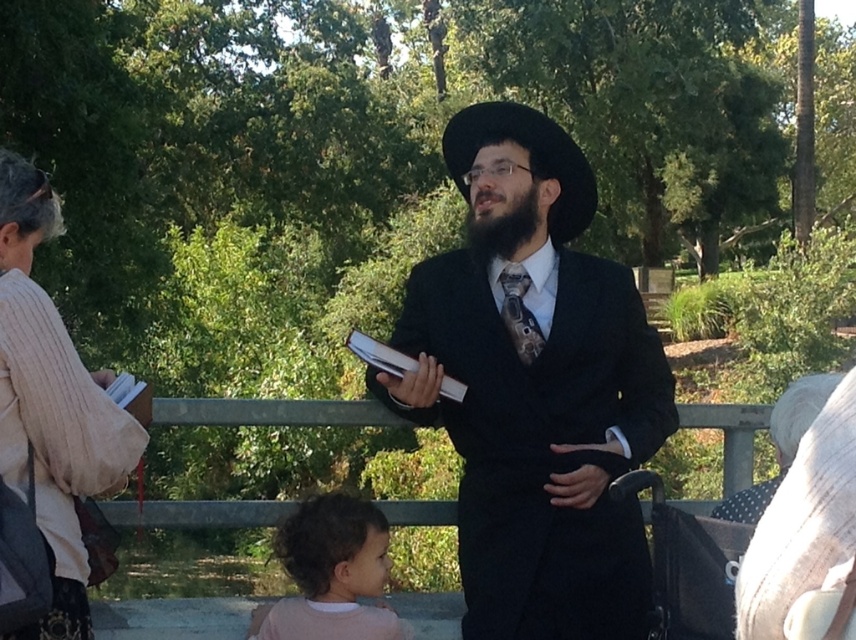
Looking at this image, which is below, curly hair at lower left or black felt hat at center?

curly hair at lower left is below.

Who is more distant from viewer, (366, 513) or (556, 147)?

Point (366, 513)

Which is in front, point (319, 579) or point (465, 170)?

Point (465, 170)

Where is `curly hair at lower left`? Image resolution: width=856 pixels, height=640 pixels. curly hair at lower left is located at coordinates (330, 573).

Who is more forward, [575,212] or [508,289]?

Point [508,289] is in front.

Measure the distance between point (548, 144) and camera.

3.54 meters

At what (x,y) coordinates should I click in order to perform the action: click on black felt hat at center. Please return your answer as a coordinate pair (x, y). This screenshot has height=640, width=856. Looking at the image, I should click on (528, 157).

Who is lower down, matte black suit at center or dark gray textured tie at center?

matte black suit at center is lower down.

At what (x,y) coordinates should I click in order to perform the action: click on matte black suit at center. Please return your answer as a coordinate pair (x, y). This screenshot has height=640, width=856. Looking at the image, I should click on (536, 396).